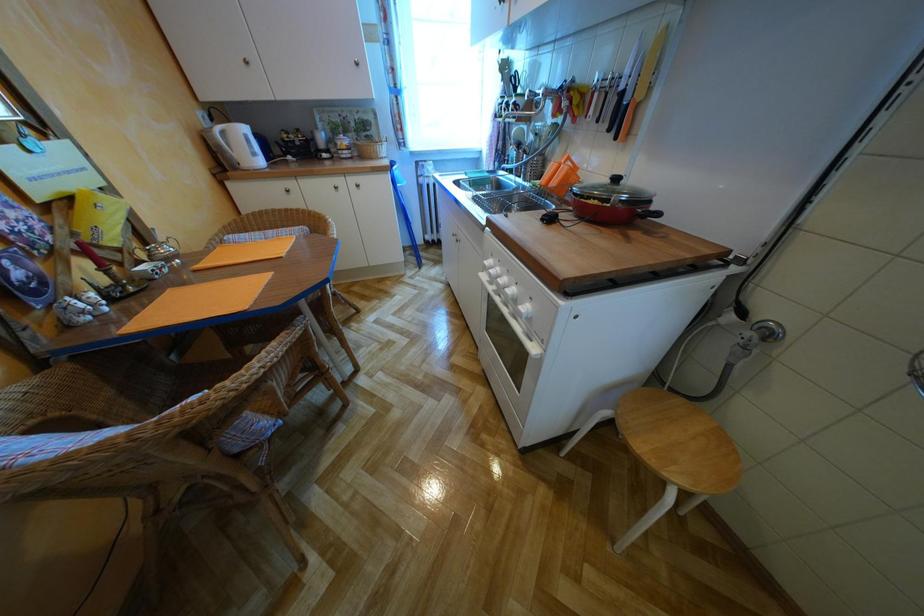
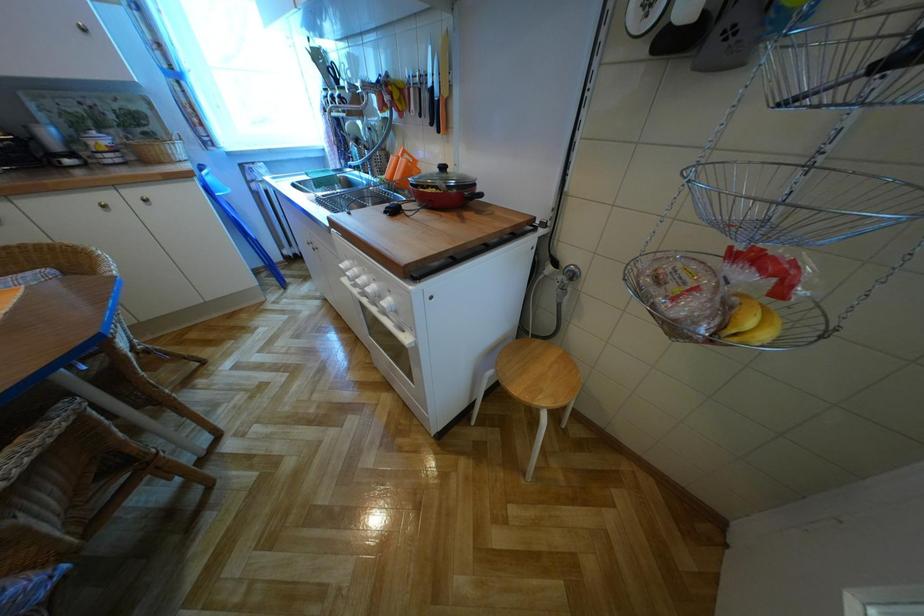
Question: What movement of the cameraman would produce the second image?

Choices:
 (A) Left
 (B) Right
 (C) Forward
 (D) Backward

Answer: (B)